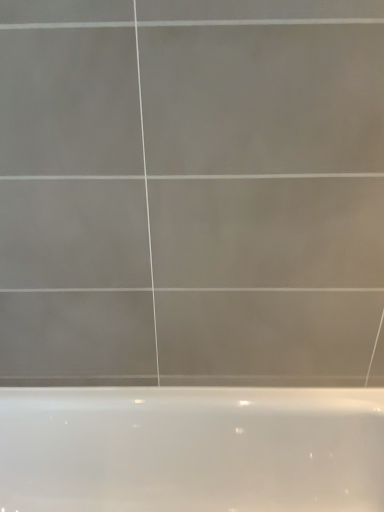
What do you see at coordinates (191, 449) in the screenshot?
I see `white glossy bathtub at bottom` at bounding box center [191, 449].

Identify the location of white glossy bathtub at bottom. The width and height of the screenshot is (384, 512). (191, 449).

You are a GUI agent. You are given a task and a screenshot of the screen. Output one action in this format:
    pyautogui.click(x=<x>, y=<y>)
    Task: Click on the white glossy bathtub at bottom
    The width and height of the screenshot is (384, 512).
    Given the screenshot: What is the action you would take?
    pyautogui.click(x=191, y=449)